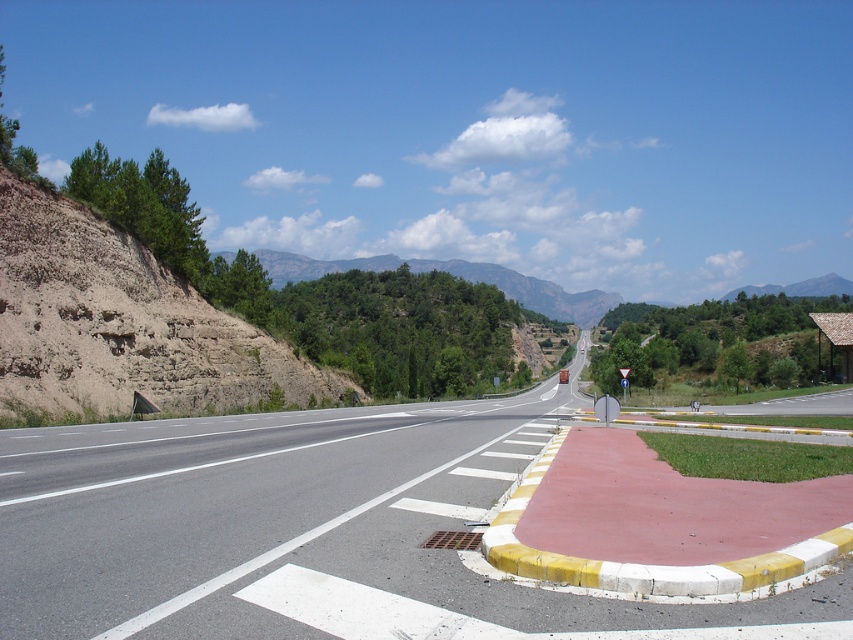
Does asphalt road at center have a greater height compared to green forested mountain at upper center?

No.

Can you confirm if asphalt road at center is bigger than green forested mountain at upper center?

Incorrect, asphalt road at center is not larger than green forested mountain at upper center.

Is point (154, 528) less distant than point (410, 264)?

Yes, point (154, 528) is closer to viewer.

Identify the location of asphalt road at center. Image resolution: width=853 pixels, height=640 pixels. (238, 509).

Which is above, brown rocky cliff at left or green forested mountain at upper center?

green forested mountain at upper center is higher up.

Is brown rocky cliff at left above green forested mountain at upper center?

Actually, brown rocky cliff at left is below green forested mountain at upper center.

Does point (135, 257) come farther from viewer compared to point (280, 273)?

No, (135, 257) is in front of (280, 273).

Locate an element on the screen. This screenshot has height=640, width=853. brown rocky cliff at left is located at coordinates (122, 323).

Can you confirm if asphalt road at center is positioned to the right of brown rocky cliff at left?

Correct, you'll find asphalt road at center to the right of brown rocky cliff at left.

Is asphalt road at center taller than brown rocky cliff at left?

Incorrect, asphalt road at center's height is not larger of brown rocky cliff at left's.

Identify the location of asphalt road at center. Image resolution: width=853 pixels, height=640 pixels. (238, 509).

You are a GUI agent. You are given a task and a screenshot of the screen. Output one action in this format:
    pyautogui.click(x=<x>, y=<y>)
    Task: Click on the asphalt road at center
    
    Given the screenshot: What is the action you would take?
    pyautogui.click(x=238, y=509)